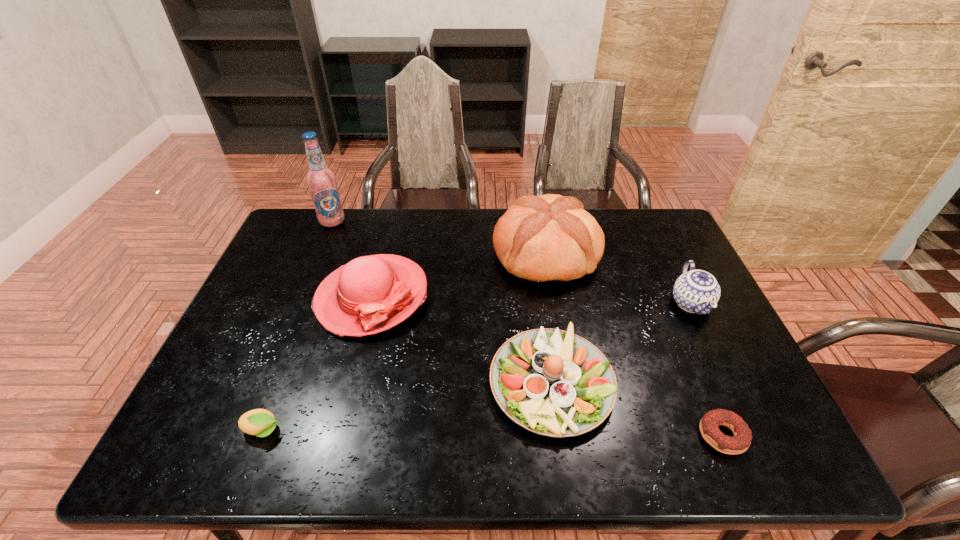
Where is `vacant area located at the spout of the chinaware`? vacant area located at the spout of the chinaware is located at coordinates (733, 392).

This screenshot has width=960, height=540. In order to click on vacant space situated 0.400m on the back of the salad plate in this screenshot , I will do `click(532, 239)`.

Locate an element on the screen. The height and width of the screenshot is (540, 960). free spot located with leaves positioned above the second shortest object is located at coordinates (393, 430).

Locate an element on the screen. The height and width of the screenshot is (540, 960). free space located on the left of the shortest object is located at coordinates (621, 435).

In order to click on alcohol located at the far edge in this screenshot , I will do coord(321,181).

Find the location of a particular element. The height and width of the screenshot is (540, 960). bread that is at the far edge is located at coordinates 550,237.

Where is `salad plate that is positioned at the near edge`? salad plate that is positioned at the near edge is located at coordinates (552, 382).

The image size is (960, 540). What are the coordinates of `lemon at the near edge` in the screenshot? It's located at (260, 422).

This screenshot has width=960, height=540. What are the coordinates of `doughnut located at the near edge` in the screenshot? It's located at (709, 425).

This screenshot has width=960, height=540. I want to click on alcohol that is at the left edge, so click(321, 181).